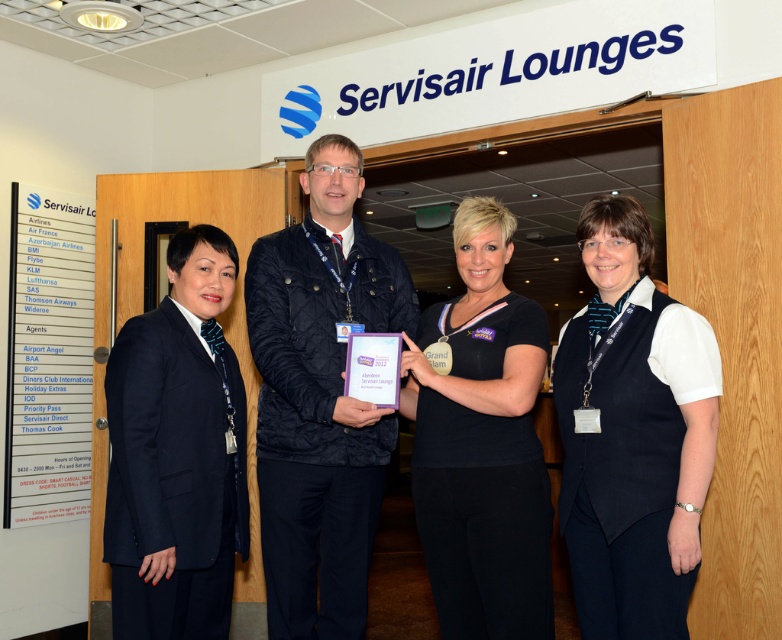
Question: Considering the relative positions of dark blue quilted jacket at center and navy blue suit at left in the image provided, where is dark blue quilted jacket at center located with respect to navy blue suit at left?

Choices:
 (A) left
 (B) right

Answer: (B)

Question: Which object is closer to the camera taking this photo?

Choices:
 (A) navy blue suit at left
 (B) dark blue quilted jacket at center
 (C) black fabric shirt at center

Answer: (A)

Question: Considering the real-world distances, which object is farthest from the navy blue vest at center?

Choices:
 (A) navy blue suit at left
 (B) black fabric shirt at center
 (C) dark blue quilted jacket at center

Answer: (A)

Question: Is navy blue vest at center to the left of black fabric shirt at center from the viewer's perspective?

Choices:
 (A) no
 (B) yes

Answer: (A)

Question: Which is nearer to the dark blue quilted jacket at center?

Choices:
 (A) black fabric shirt at center
 (B) navy blue vest at center

Answer: (A)

Question: Can you confirm if dark blue quilted jacket at center is thinner than navy blue suit at left?

Choices:
 (A) yes
 (B) no

Answer: (B)